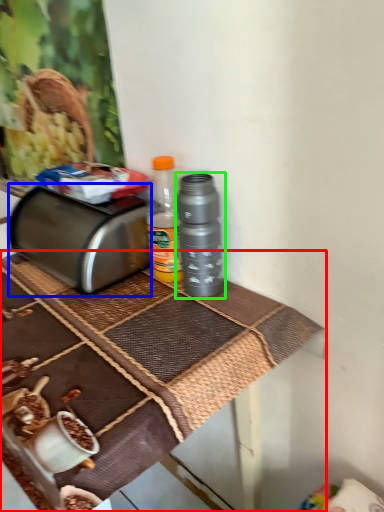
Question: Which object is positioned farthest from table (highlighted by a red box)? Select from toaster (highlighted by a blue box) and bottle (highlighted by a green box).

Choices:
 (A) toaster
 (B) bottle

Answer: (B)